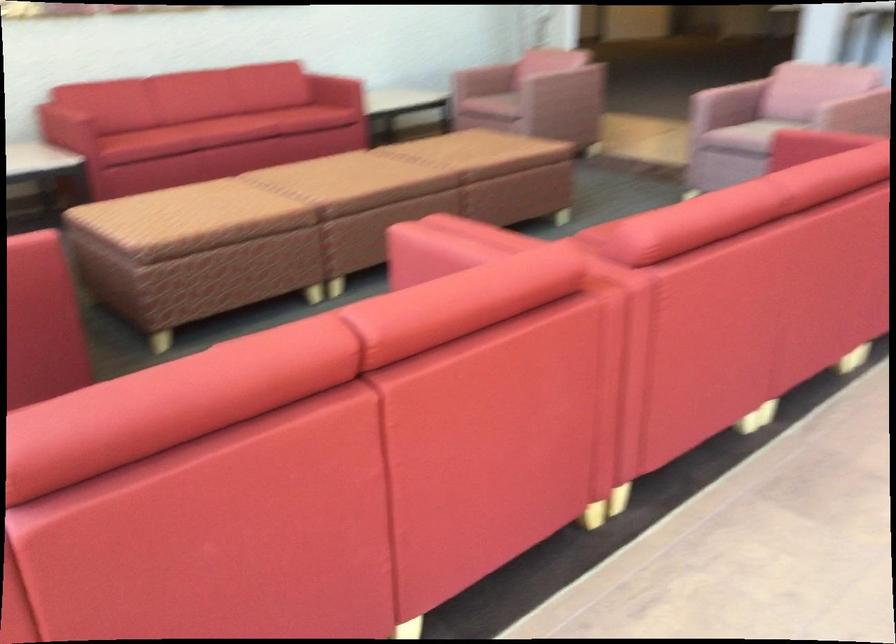
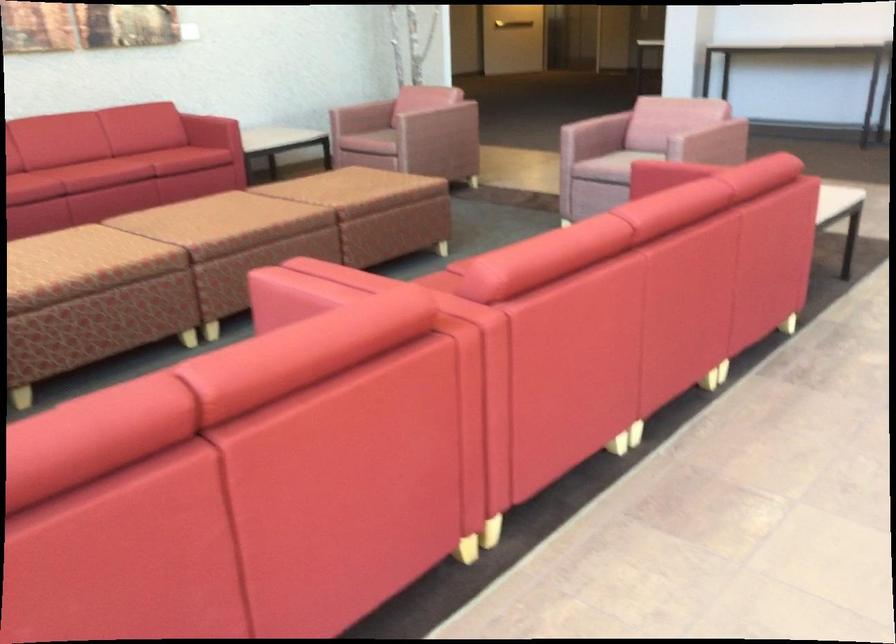
Question: How did the camera likely rotate?

Choices:
 (A) Left
 (B) Right
 (C) Up
 (D) Down

Answer: (B)